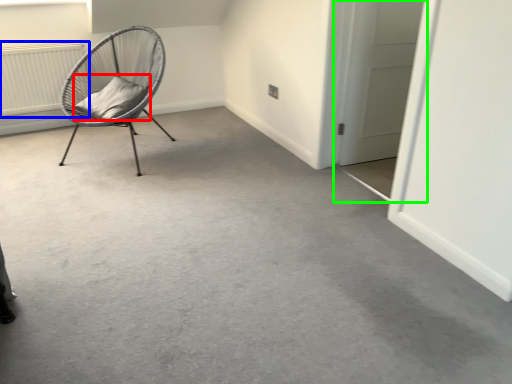
Question: Which object is positioned farthest from pillow (highlighted by a red box)? Select from radiator (highlighted by a blue box) and door (highlighted by a green box).

Choices:
 (A) radiator
 (B) door

Answer: (B)